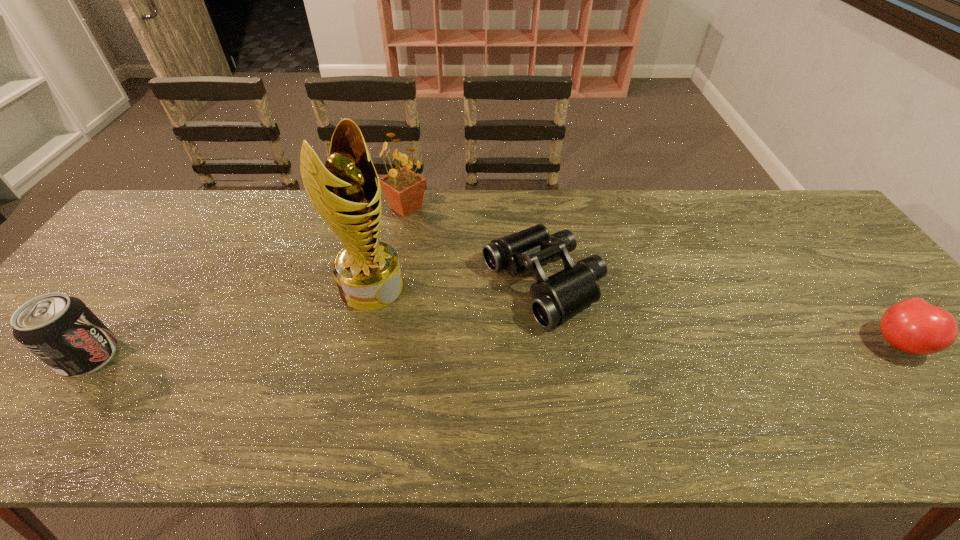
The width and height of the screenshot is (960, 540). Find the location of `free spot located on the front-facing side of the award`. free spot located on the front-facing side of the award is located at coordinates (418, 315).

This screenshot has width=960, height=540. I want to click on vacant space located on the front-facing side of the second object from right to left, so click(x=465, y=323).

This screenshot has height=540, width=960. In order to click on vacant point located 0.140m on the front-facing side of the second object from right to left in this screenshot , I will do `click(444, 334)`.

Image resolution: width=960 pixels, height=540 pixels. In order to click on free space located 0.330m on the front-facing side of the second object from right to left in this screenshot , I will do `click(370, 369)`.

At what (x,y) coordinates should I click in order to perform the action: click on free space located at the front of the second tallest object with flowers visible. Please return your answer as a coordinate pair (x, y). The image size is (960, 540). Looking at the image, I should click on (398, 251).

The height and width of the screenshot is (540, 960). What are the coordinates of `vacant region located 0.400m at the front of the second tallest object with flowers visible` in the screenshot? It's located at (386, 325).

Locate an element on the screen. The image size is (960, 540). vacant space located 0.210m at the front of the second tallest object with flowers visible is located at coordinates (396, 270).

Identify the location of object that is at the far edge. (404, 189).

This screenshot has height=540, width=960. What are the coordinates of `object located in the near edge section of the desktop` in the screenshot? It's located at (x=60, y=330).

This screenshot has width=960, height=540. What are the coordinates of `object that is at the left edge` in the screenshot? It's located at point(60,330).